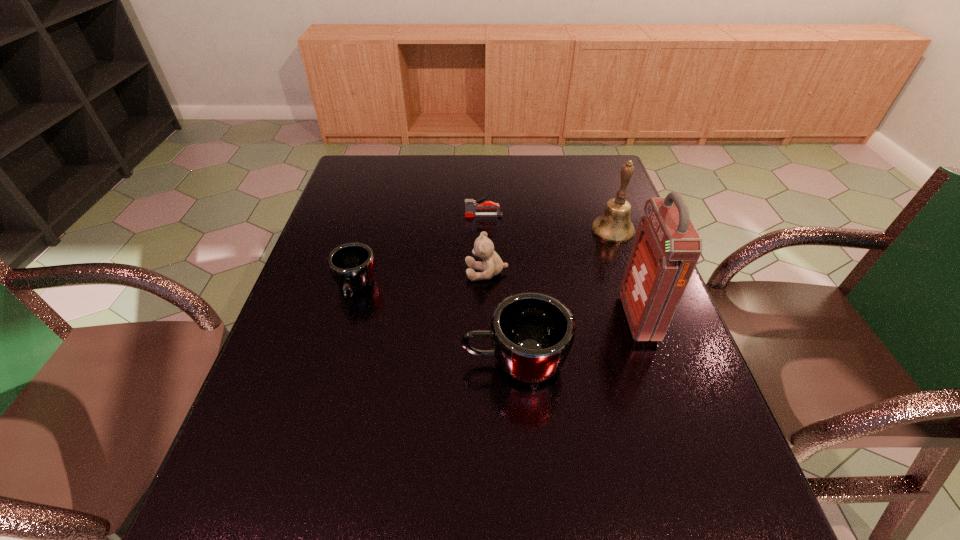
At what (x,y) coordinates should I click in order to perform the action: click on vacant space positioned on the side of the third tallest object with the handle. Please return your answer as a coordinate pair (x, y). The image size is (960, 540). Looking at the image, I should click on (440, 362).

Identify the location of free space located 0.290m on the side of the third tallest object with the handle. (327, 362).

You are a GUI agent. You are given a task and a screenshot of the screen. Output one action in this format:
    pyautogui.click(x=<x>, y=<y>)
    Task: Click on the vacant space situated 0.220m on the left of the second tallest object
    Image resolution: width=960 pixels, height=540 pixels.
    Given the screenshot: What is the action you would take?
    pyautogui.click(x=516, y=230)

This screenshot has height=540, width=960. I want to click on free space located on the handle side of the stapler, so click(348, 216).

Locate an element on the screen. This screenshot has width=960, height=540. vacant region located 0.160m on the handle side of the stapler is located at coordinates point(412,216).

You are a GUI agent. You are given a task and a screenshot of the screen. Output one action in this format:
    pyautogui.click(x=<x>, y=<y>)
    Task: Click on the vacant area situated on the handle side of the stapler
    
    Given the screenshot: What is the action you would take?
    pyautogui.click(x=386, y=216)

This screenshot has width=960, height=540. I want to click on free location located on the front-facing side of the tallest object, so click(472, 318).

Where is `vacant area situated on the front-facing side of the tallest object`? vacant area situated on the front-facing side of the tallest object is located at coordinates (537, 318).

At what (x,y) coordinates should I click in order to perform the action: click on free space located 0.090m on the front-facing side of the tallest object. Please return your answer as a coordinate pair (x, y). This screenshot has height=540, width=960. Looking at the image, I should click on (588, 318).

Image resolution: width=960 pixels, height=540 pixels. I want to click on free location located on the face of the teddy bear, so click(320, 272).